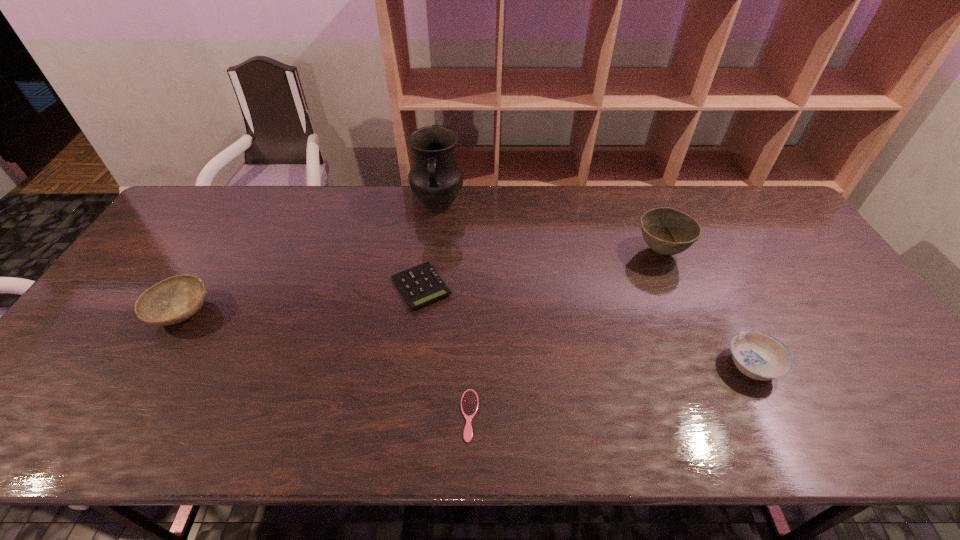
Where is `free space between the fourth tallest object and the shortest object`? free space between the fourth tallest object and the shortest object is located at coordinates [611, 390].

Where is `free spot between the leftmost bowl and the fourth tallest object`? free spot between the leftmost bowl and the fourth tallest object is located at coordinates (467, 339).

You are a GUI agent. You are given a task and a screenshot of the screen. Output one action in this format:
    pyautogui.click(x=<x>, y=<y>)
    Task: Click on the free spot between the second shortest object and the farthest bowl
    
    Given the screenshot: What is the action you would take?
    pyautogui.click(x=540, y=269)

At what (x,y) coordinates should I click in order to perform the action: click on empty space between the second tallest object and the tallest object. Please return your answer as a coordinate pair (x, y). The height and width of the screenshot is (540, 960). Looking at the image, I should click on (549, 228).

Where is `free spot between the fourth tallest object and the second shortest object`? Image resolution: width=960 pixels, height=540 pixels. free spot between the fourth tallest object and the second shortest object is located at coordinates (587, 326).

Image resolution: width=960 pixels, height=540 pixels. In order to click on vacant point located between the pitcher and the shortest object in this screenshot , I will do `click(454, 310)`.

Identify the location of free area in between the pitcher and the calculator. This screenshot has width=960, height=540. (430, 246).

Select which object appears as the second closest to the third object from right to left. Please provide its 2D coordinates. Your answer should be formatted as a tuple, i.e. [(x, y)], where the tuple contains the x and y coordinates of a point satisfying the conditions above.

[(758, 355)]

Identify which object is the fifth nearest to the farthest bowl. Please provide its 2D coordinates. Your answer should be formatted as a tuple, i.e. [(x, y)], where the tuple contains the x and y coordinates of a point satisfying the conditions above.

[(173, 300)]

At what (x,y) coordinates should I click in order to perform the action: click on bowl that is the nearest to the second farthest bowl. Please return your answer as a coordinate pair (x, y). Image resolution: width=960 pixels, height=540 pixels. Looking at the image, I should click on (667, 231).